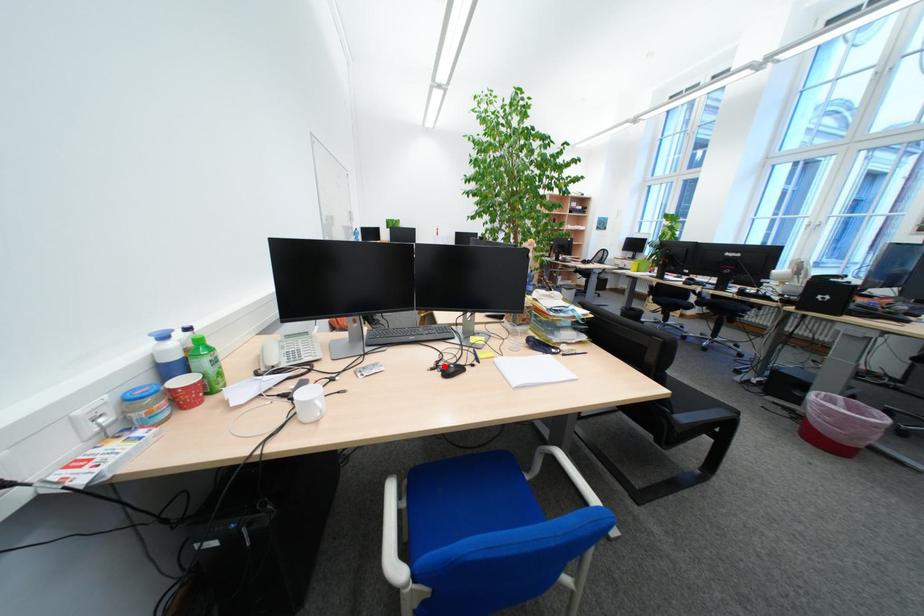
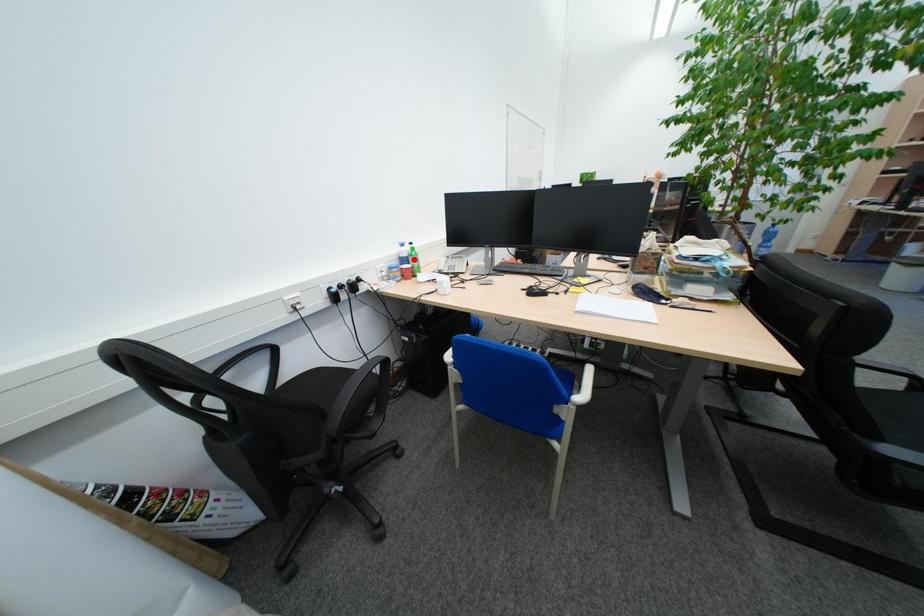
I am providing you with two images of the same scene from different viewpoints. A red point is marked on the first image and another point is marked on the second image. Does the point marked in image1 correspond to the same location as the one in image2?

No